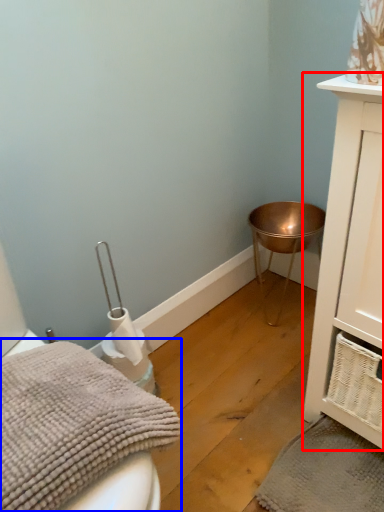
Question: Which object appears closest to the camera in this image, bathroom cabinet (highlighted by a red box) or bath towel (highlighted by a blue box)?

Choices:
 (A) bathroom cabinet
 (B) bath towel

Answer: (B)